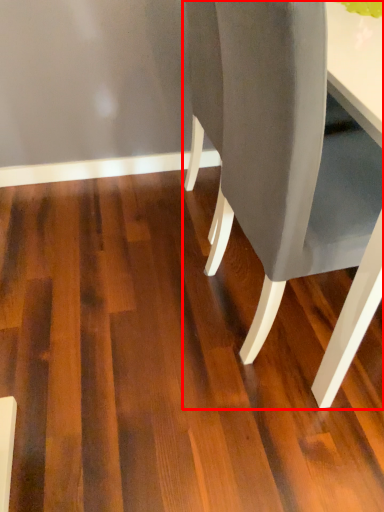
Question: In this image, where is chair (annotated by the red box) located relative to plywood?

Choices:
 (A) right
 (B) left

Answer: (A)